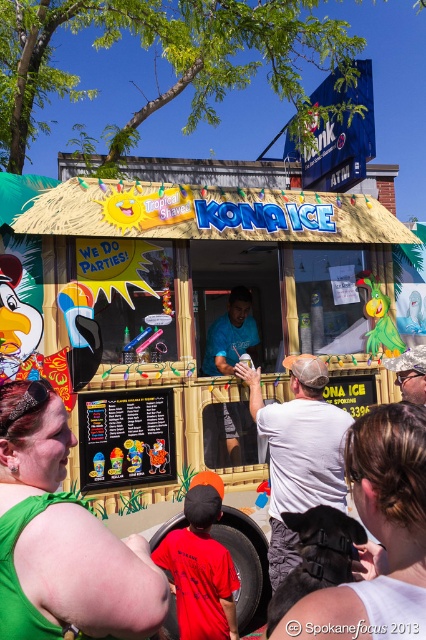
You are a customer waiting in line at the Kona Ice stand. You notice the matte wooden food truck at center and the green fabric dress at lower left. How far apart are these two items from each other?

The matte wooden food truck at center is 8.43 feet away from the green fabric dress at lower left.

You are standing at the point marked at coordinate point (x=26, y=467). You want to walk to the entrance of the Tropical Shaved Kona Ice stand. The entrance is 1.58 meters away from your current position. If you walk straight towards the entrance, will you be able to reach it without any obstacles?

Yes, since the entrance is 1.58 meters away from the point (x=26, y=467), walking straight towards it will allow you to reach the entrance without any obstacles.

You are standing at the entrance of the Kona Ice stand. You see a point marked at coordinate (89, 573). What object is located at that point?

The point at coordinate (89, 573) marks the green fabric dress at lower left.